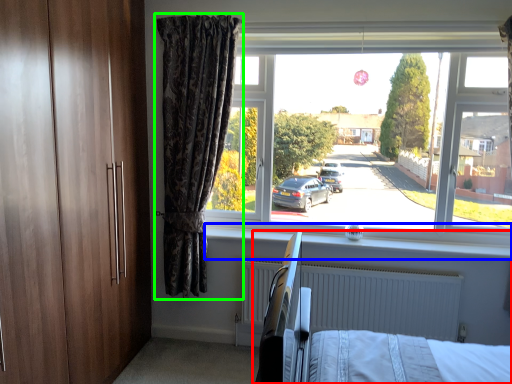
Question: Considering the real-world distances, which object is closest to hospital bed (highlighted by a red box)? window sill (highlighted by a blue box) or curtain (highlighted by a green box).

Choices:
 (A) window sill
 (B) curtain

Answer: (A)